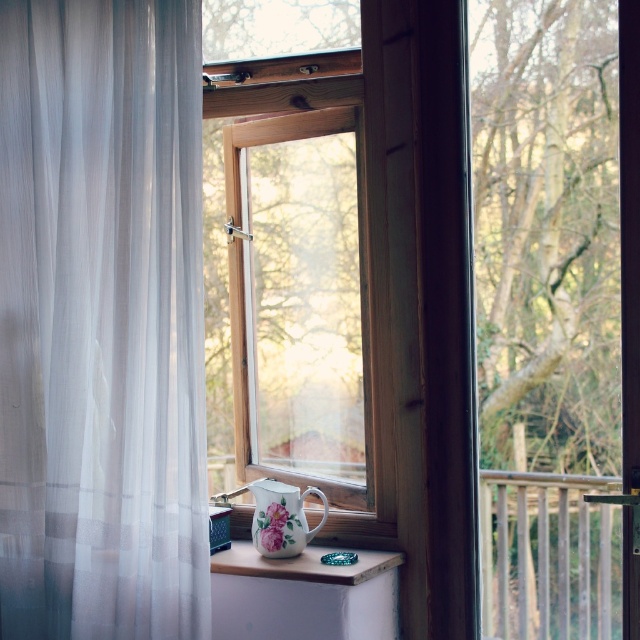
You are standing in the room looking through the window. There is a point at coordinates (100,321). What object is located at that point?

The point at coordinates (100,321) is occupied by the white sheer curtain at left.

You are standing in the room looking at the window. There are two points marked in the scene, one at point coordinates point (17, 156) and the other at point coordinates point (257, 540). Which point is closer to you?

Point (17, 156) is closer to the viewer than point (257, 540).

You are arranging flowers in the room. You have a white wood at center and a porcelain floral pitcher at center. Where should you place the flowers to ensure they are visible from the window?

You should place the flowers in the white wood at center because it is located below the porcelain floral pitcher at center, making it visible from the window.